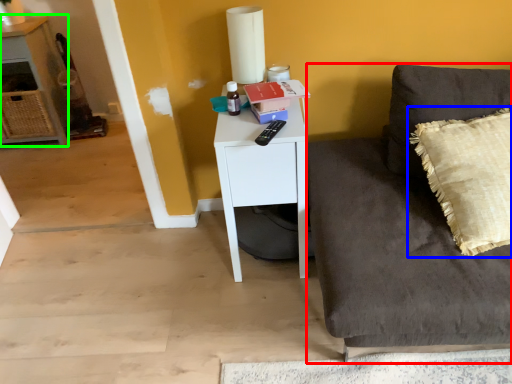
Question: Estimate the real-world distances between objects in this image. Which object is farther from studio couch (highlighted by a red box), pillow (highlighted by a blue box) or cabinetry (highlighted by a green box)?

Choices:
 (A) pillow
 (B) cabinetry

Answer: (B)